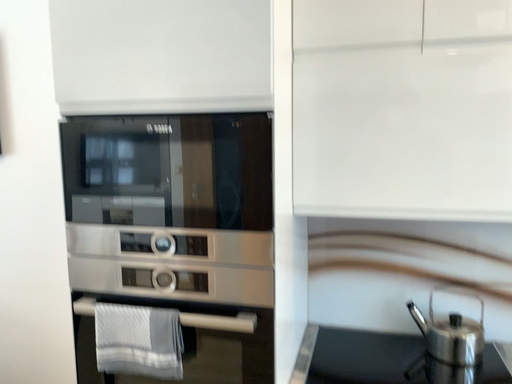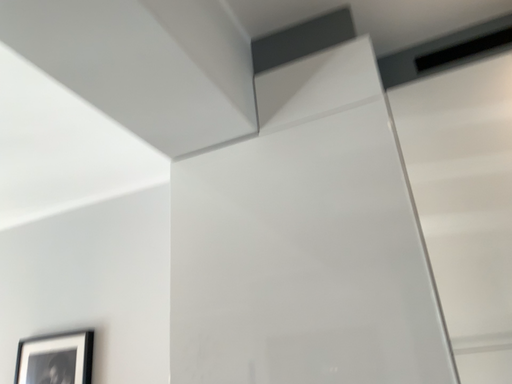
Question: Which way did the camera rotate in the video?

Choices:
 (A) rotated downward
 (B) rotated upward

Answer: (B)